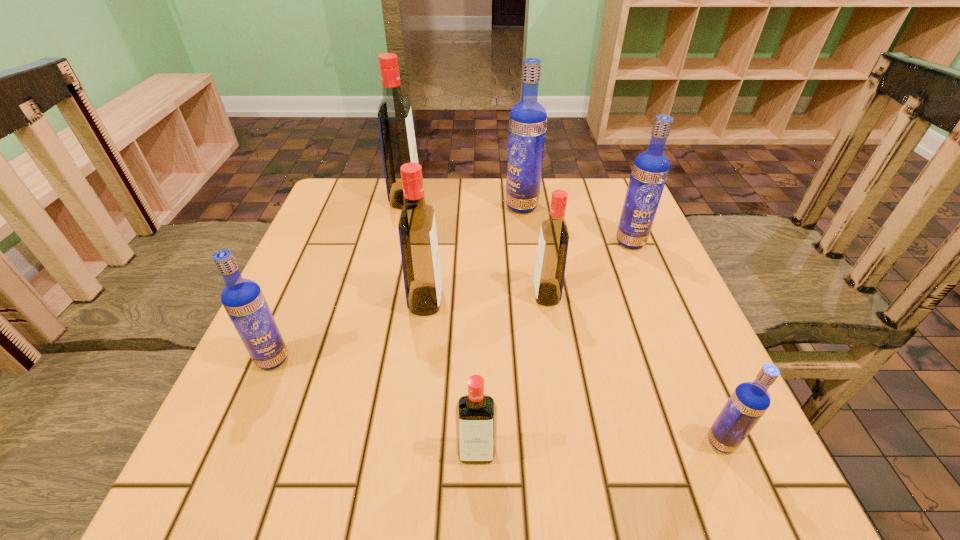
Find the location of `the fourth closest blue vodka to the third biggest red vodka`. the fourth closest blue vodka to the third biggest red vodka is located at coordinates (243, 299).

Locate an element on the screen. Image resolution: width=960 pixels, height=540 pixels. free location that satisfies the following two spatial constraints: 1. on the front and back of the second object from left to right; 2. on the back side of the second biggest blue vodka is located at coordinates (396, 242).

Where is `vacant area that satisfies the following two spatial constraints: 1. on the front and back of the farthest red vodka; 2. on the left side of the nearest blue vodka`? The width and height of the screenshot is (960, 540). vacant area that satisfies the following two spatial constraints: 1. on the front and back of the farthest red vodka; 2. on the left side of the nearest blue vodka is located at coordinates (349, 442).

At what (x,y) coordinates should I click in order to perform the action: click on free spot that satisfies the following two spatial constraints: 1. on the front and back of the nearest blue vodka; 2. on the right side of the second red vodka from left to right. Please return your answer as a coordinate pair (x, y). The image size is (960, 540). Looking at the image, I should click on (408, 442).